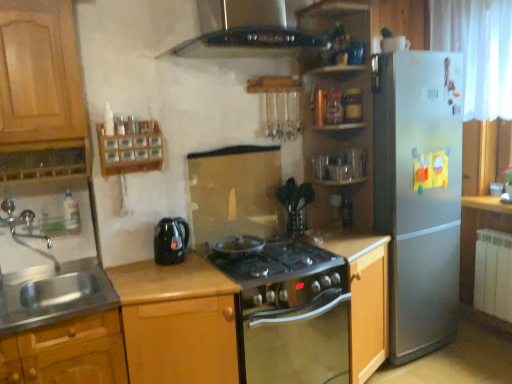
Find the location of a particular element. The image size is (512, 384). free point below wooden spice rack at upper left (from a real-world perspective) is located at coordinates (135, 266).